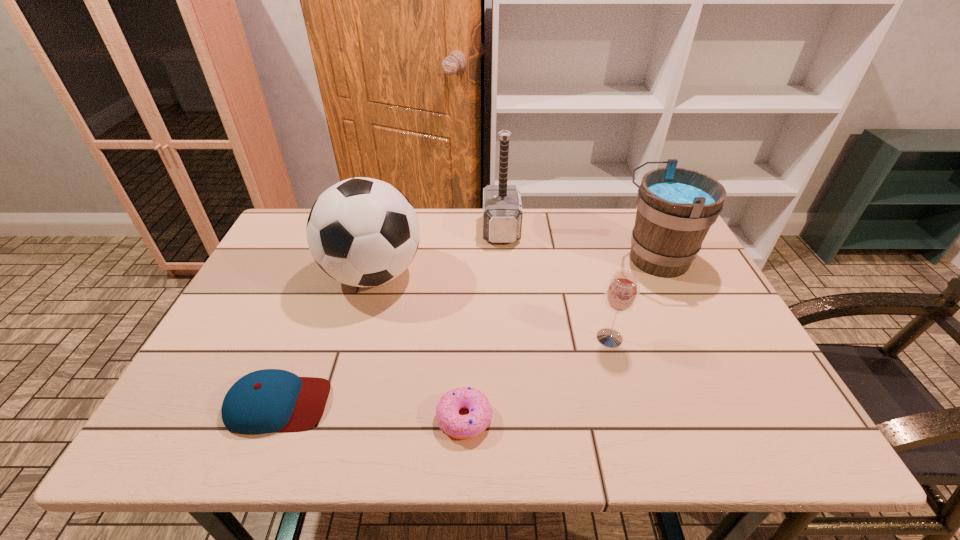
I want to click on hammer, so click(x=502, y=209).

Locate an element on the screen. soccer ball is located at coordinates (363, 232).

In order to click on the rightmost object in this screenshot , I will do `click(676, 207)`.

Locate an element on the screen. The height and width of the screenshot is (540, 960). the third nearest object is located at coordinates (622, 291).

Locate an element on the screen. the third shortest object is located at coordinates (622, 291).

This screenshot has height=540, width=960. In order to click on baseball cap in this screenshot , I will do `click(270, 400)`.

This screenshot has height=540, width=960. In order to click on doughnut in this screenshot , I will do `click(458, 426)`.

At what (x,y) coordinates should I click in order to perform the action: click on free region located 0.210m for striking with the head of the hammer. Please return your answer as a coordinate pair (x, y). The image size is (960, 540). Looking at the image, I should click on (418, 230).

Identify the location of free space located 0.150m for striking with the head of the hammer. This screenshot has height=540, width=960. (437, 230).

Identify the location of free space located 0.090m for striking with the head of the hammer. (455, 230).